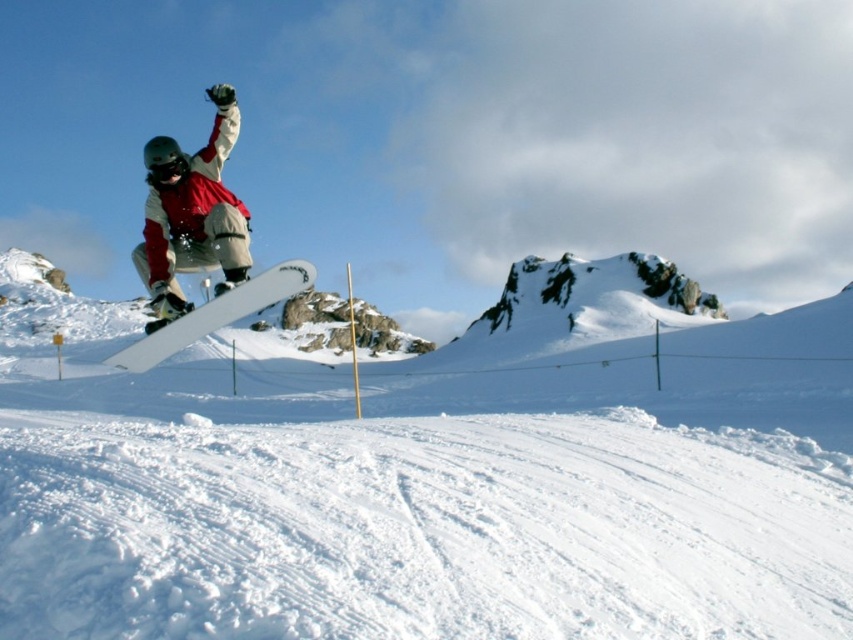
Is white matte snowboard at upper left bigger than white matte snowboard at center?

Yes.

Locate an element on the screen. Image resolution: width=853 pixels, height=640 pixels. white matte snowboard at upper left is located at coordinates (431, 476).

Is point (746, 323) closer to viewer compared to point (267, 272)?

That is False.

At what (x,y) coordinates should I click in order to perform the action: click on white matte snowboard at upper left. Please return your answer as a coordinate pair (x, y). Looking at the image, I should click on (431, 476).

Does matte white snowboard at center appear on the right side of white matte snowboard at center?

Yes, matte white snowboard at center is to the right of white matte snowboard at center.

Is matte white snowboard at center positioned at the back of white matte snowboard at center?

Yes, matte white snowboard at center is behind white matte snowboard at center.

Find the location of a particular element. matte white snowboard at center is located at coordinates (198, 243).

Where is `matte white snowboard at center`? This screenshot has width=853, height=640. matte white snowboard at center is located at coordinates (198, 243).